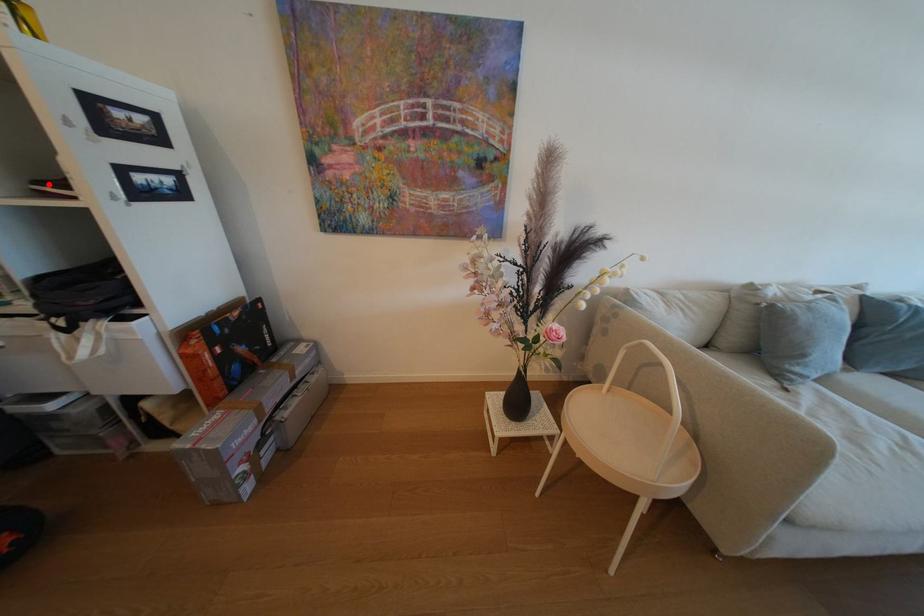
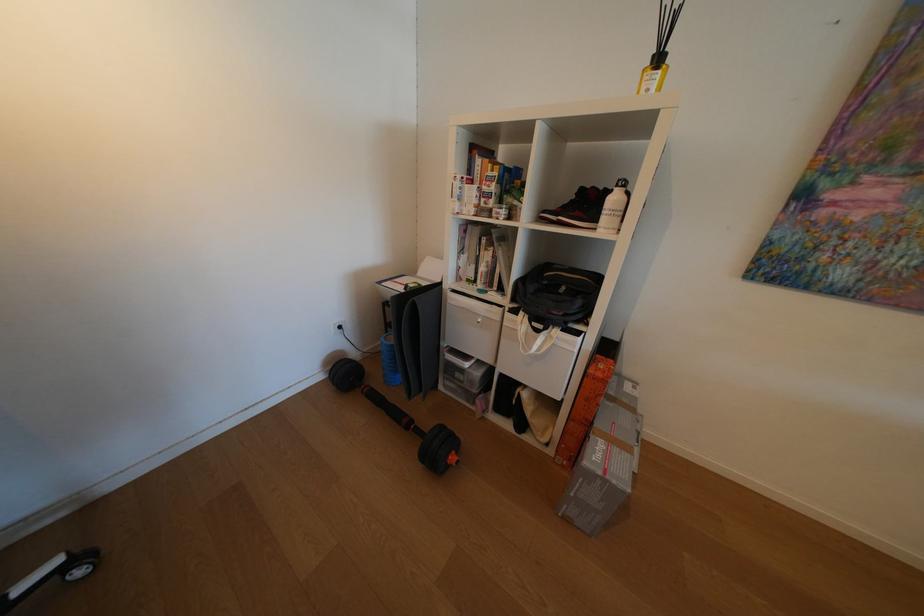
The point at the highlighted location is marked in the first image. Where is the corresponding point in the second image?

(554, 213)